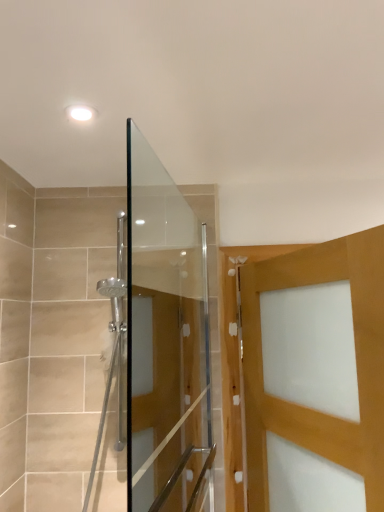
Question: Should I look upward or downward to see matte wooden door at right?

Choices:
 (A) up
 (B) down

Answer: (B)

Question: From the image's perspective, is matte wooden door at right above transparent glass shower door at center?

Choices:
 (A) yes
 (B) no

Answer: (B)

Question: Does matte wooden door at right come behind transparent glass shower door at center?

Choices:
 (A) no
 (B) yes

Answer: (B)

Question: Is matte wooden door at right not close to transparent glass shower door at center?

Choices:
 (A) yes
 (B) no

Answer: (B)

Question: Does matte wooden door at right have a smaller size compared to transparent glass shower door at center?

Choices:
 (A) no
 (B) yes

Answer: (A)

Question: Is matte wooden door at right positioned with its back to transparent glass shower door at center?

Choices:
 (A) no
 (B) yes

Answer: (B)

Question: Is matte wooden door at right next to transparent glass shower door at center?

Choices:
 (A) yes
 (B) no

Answer: (B)

Question: Does transparent glass shower door at center have a smaller size compared to matte wooden door at right?

Choices:
 (A) yes
 (B) no

Answer: (A)

Question: From the image's perspective, is transparent glass shower door at center located beneath matte wooden door at right?

Choices:
 (A) yes
 (B) no

Answer: (B)

Question: From a real-world perspective, is transparent glass shower door at center physically above matte wooden door at right?

Choices:
 (A) yes
 (B) no

Answer: (A)

Question: Is transparent glass shower door at center oriented towards matte wooden door at right?

Choices:
 (A) no
 (B) yes

Answer: (B)

Question: Is transparent glass shower door at center at the left side of matte wooden door at right?

Choices:
 (A) yes
 (B) no

Answer: (A)

Question: Is transparent glass shower door at center next to matte wooden door at right and touching it?

Choices:
 (A) yes
 (B) no

Answer: (B)

Question: From a real-world perspective, relative to matte wooden door at right, is transparent glass shower door at center vertically above or below?

Choices:
 (A) above
 (B) below

Answer: (A)